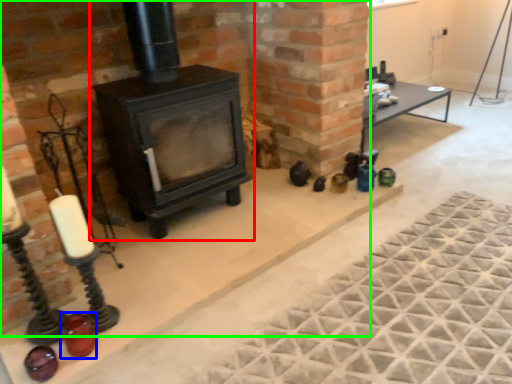
Question: Which object is the closest to the wood burning stove (highlighted by a red box)? Choose among these: candle holder (highlighted by a blue box) or fireplace (highlighted by a green box).

Choices:
 (A) candle holder
 (B) fireplace

Answer: (B)